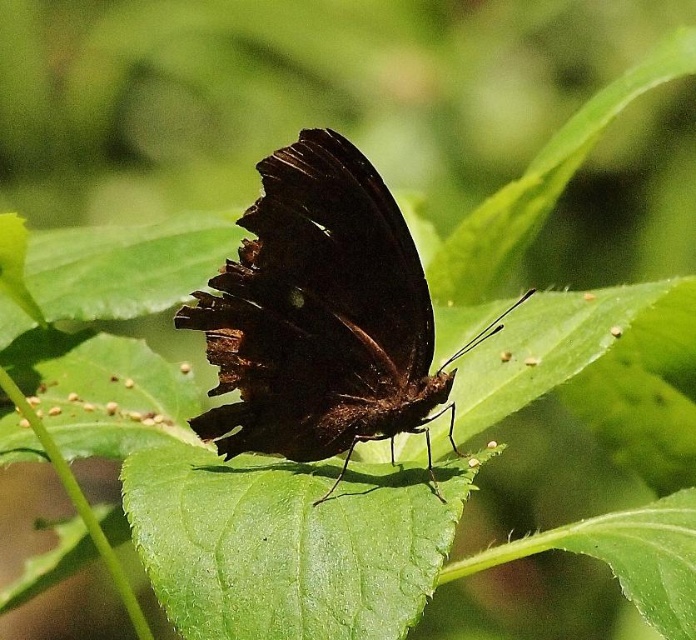
Question: Among these objects, which one is nearest to the camera?

Choices:
 (A) green glossy leaf at center
 (B) shiny brown butterfly at center

Answer: (A)

Question: Does shiny brown butterfly at center come behind green glossy leaf at center?

Choices:
 (A) yes
 (B) no

Answer: (A)

Question: Can you confirm if shiny brown butterfly at center is smaller than green glossy leaf at center?

Choices:
 (A) no
 (B) yes

Answer: (A)

Question: Which point is farther to the camera?

Choices:
 (A) shiny brown butterfly at center
 (B) green glossy leaf at center

Answer: (A)

Question: Is shiny brown butterfly at center below green glossy leaf at center?

Choices:
 (A) no
 (B) yes

Answer: (A)

Question: Which object appears closest to the camera in this image?

Choices:
 (A) shiny brown butterfly at center
 (B) green glossy leaf at center

Answer: (B)